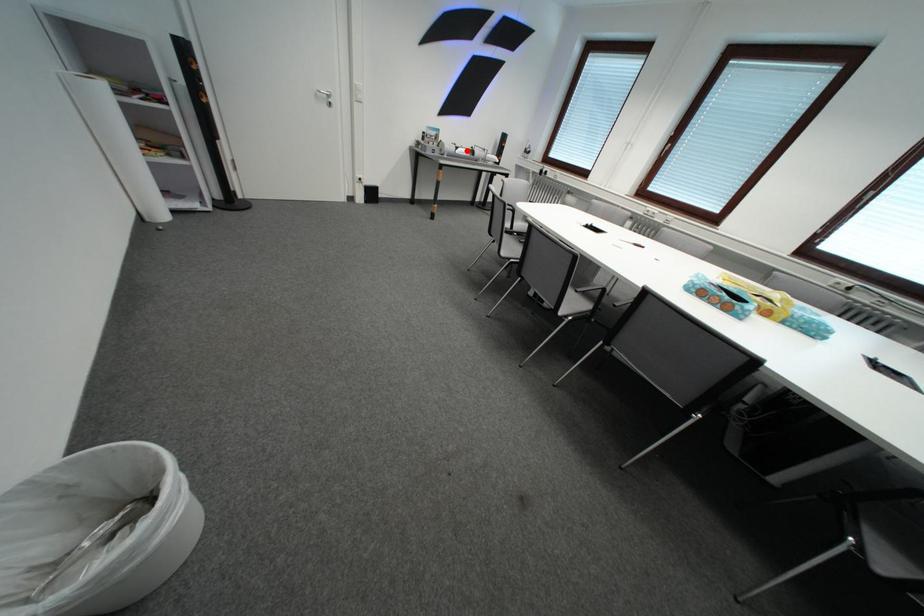
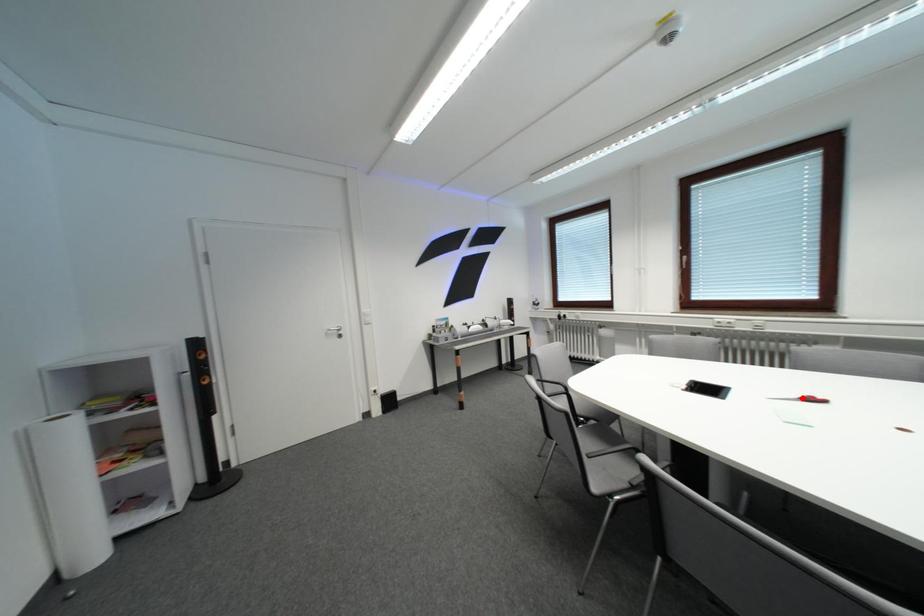
From the picture: I am providing you with two images of the same scene from different viewpoints. A red point is marked on the first image and another point is marked on the second image. Are the points marked in image1 and image2 representing the same 3D position?

No